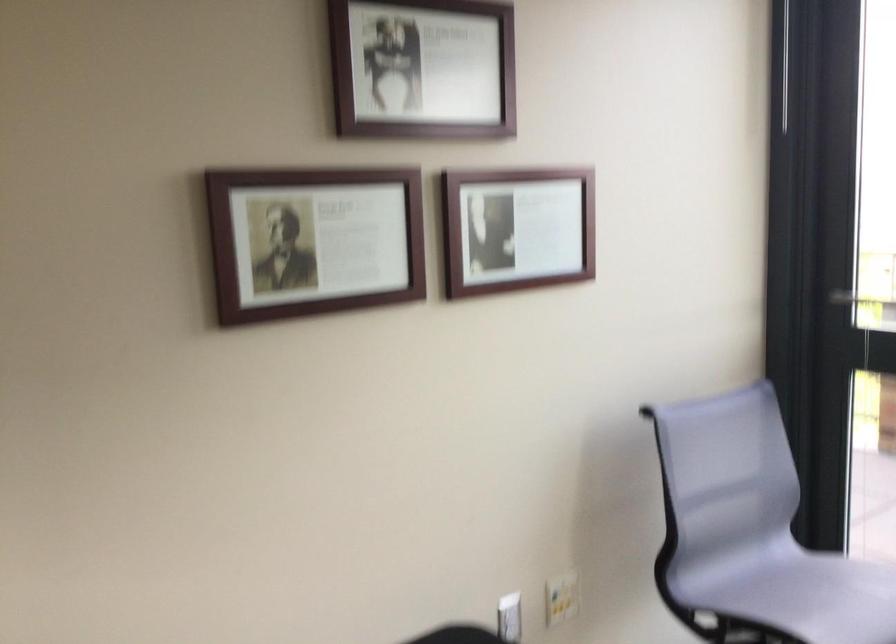
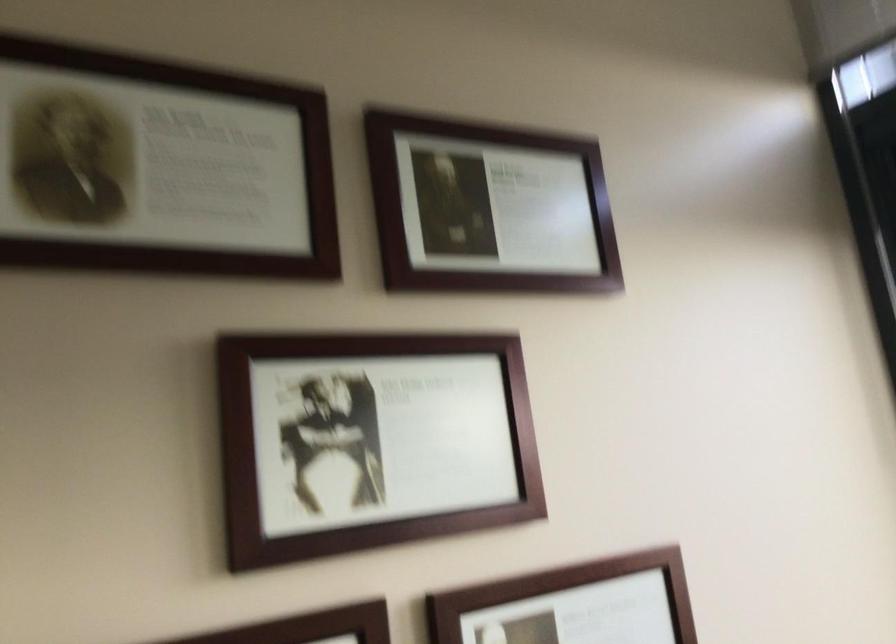
Question: What movement of the cameraman would produce the second image?

Choices:
 (A) Left
 (B) Right
 (C) Forward
 (D) Backward

Answer: (C)